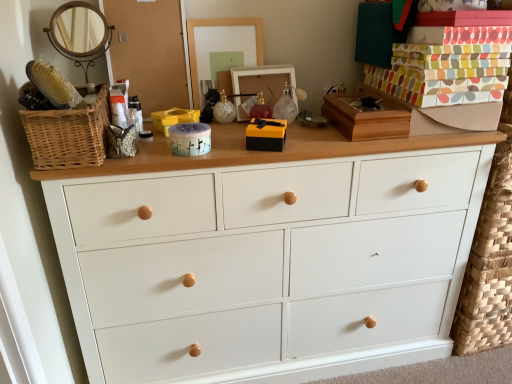
Find the location of `vacant space that is to the left of matte purple container at center, the 1th box positioned from the left`. vacant space that is to the left of matte purple container at center, the 1th box positioned from the left is located at coordinates (146, 160).